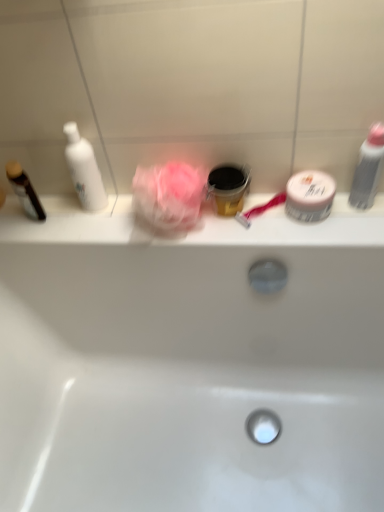
Image resolution: width=384 pixels, height=512 pixels. Identify the location of free spot to the right of dark brown glossy bottle at left, which appears as the 4th toiletry when viewed from the right. (89, 220).